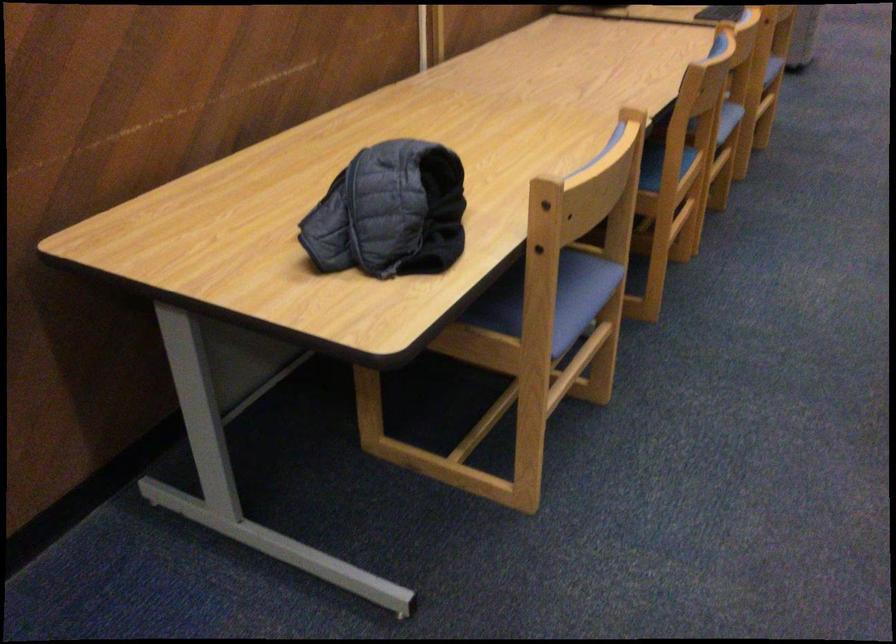
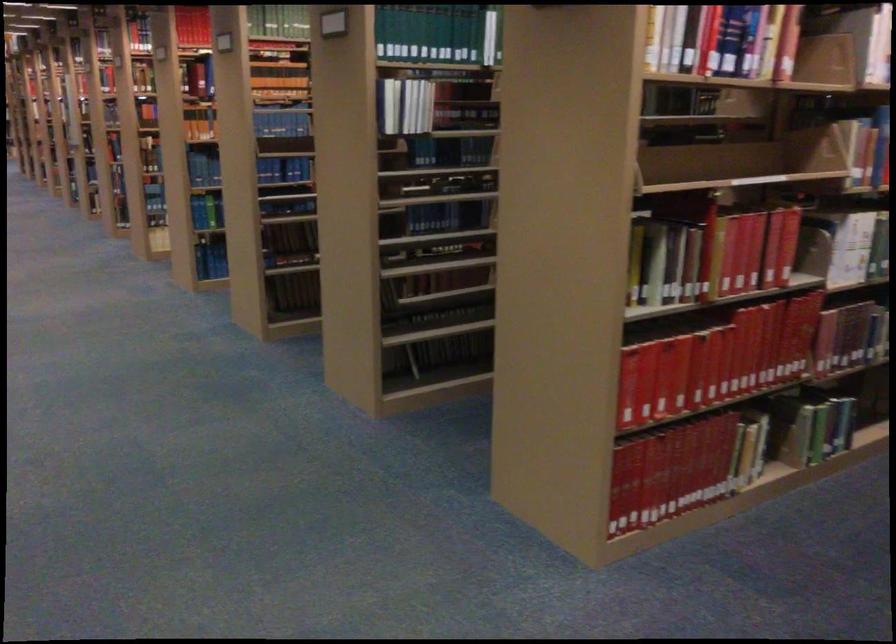
Question: The camera is either moving clockwise (left) or counter-clockwise (right) around the object. The first image is from the beginning of the video and the second image is from the end. Is the camera moving left or right when shooting the video?

Choices:
 (A) Left
 (B) Right

Answer: (A)